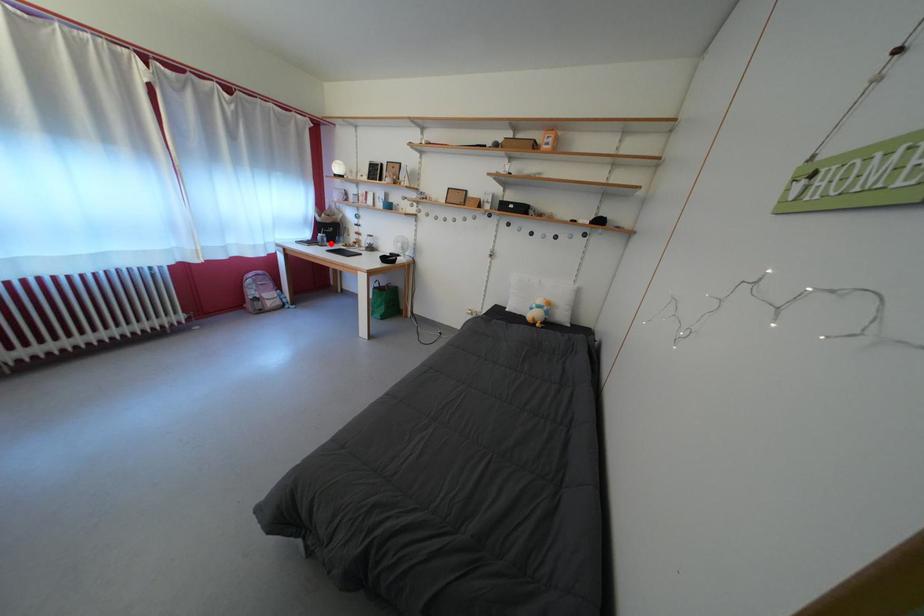
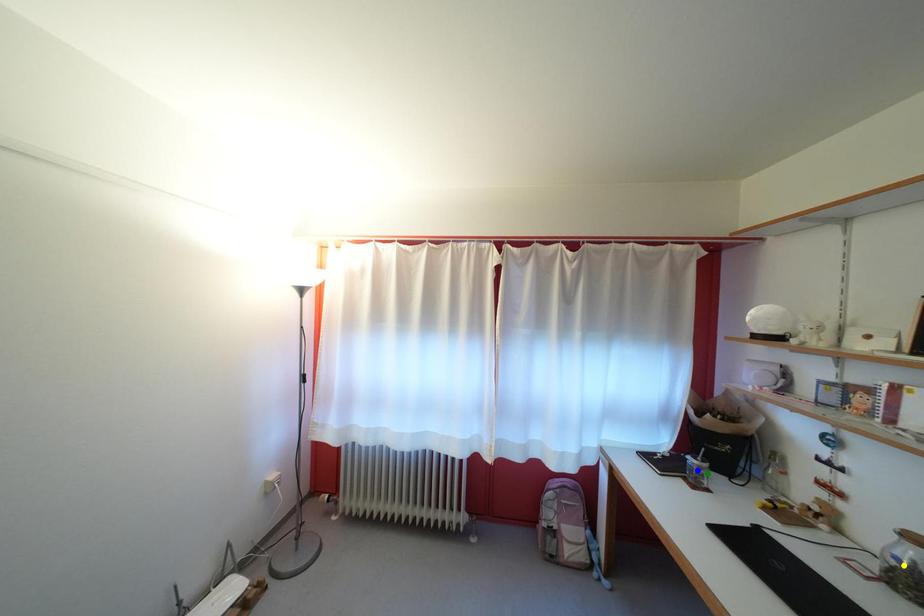
Question: I am providing you with two images of the same scene from different viewpoints. A red point is marked on the first image. You are given multiple points on the second image. Can you choose the point in image 2 that corresponds to the point in image 1?

Choices:
 (A) yellow point
 (B) green point
 (C) blue point

Answer: (B)